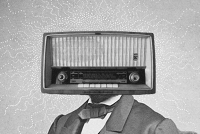
You are a GUI agent. You are given a task and a screenshot of the screen. Output one action in this format:
    pyautogui.click(x=<x>, y=<y>)
    Task: Click on the radio
    The image size is (200, 134).
    Given the screenshot: What is the action you would take?
    pyautogui.click(x=92, y=67)